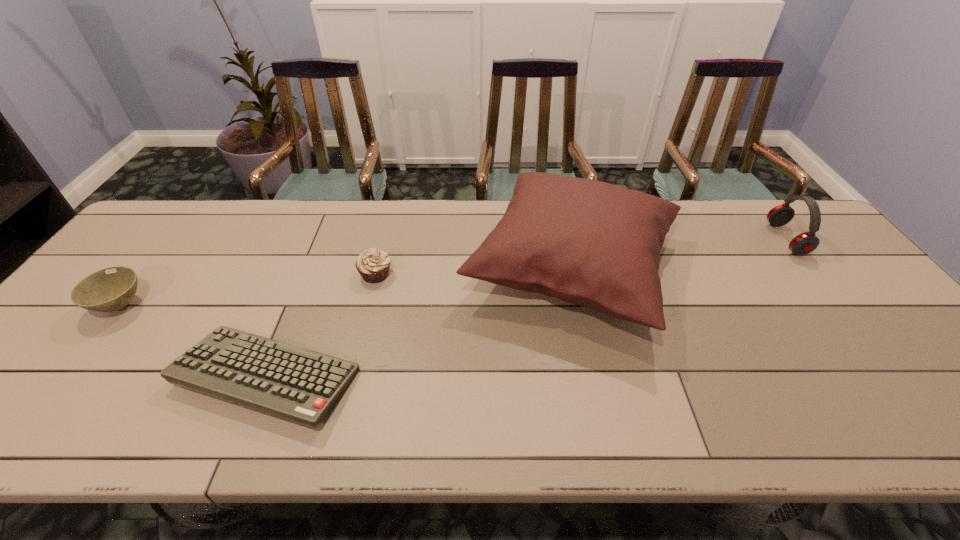
Find the location of `free space at the far edge of the desktop`. free space at the far edge of the desktop is located at coordinates (496, 218).

Where is `vacant space at the near edge of the desktop`? The image size is (960, 540). vacant space at the near edge of the desktop is located at coordinates (394, 421).

In the image, there is a desktop. Identify the location of vacant space at the left edge. Image resolution: width=960 pixels, height=540 pixels. (85, 310).

Locate an element on the screen. The image size is (960, 540). free location at the right edge of the desktop is located at coordinates (857, 312).

Locate an element on the screen. The image size is (960, 540). vacant space at the far right corner is located at coordinates (786, 225).

Identify the location of unoccupied area between the leftmost object and the muffin. The width and height of the screenshot is (960, 540). click(248, 289).

The width and height of the screenshot is (960, 540). What are the coordinates of `vacant area that lies between the bowl and the cushion` in the screenshot? It's located at (347, 286).

Locate an element on the screen. The width and height of the screenshot is (960, 540). vacant area that lies between the bowl and the muffin is located at coordinates (248, 289).

Image resolution: width=960 pixels, height=540 pixels. I want to click on vacant space that is in between the leftmost object and the shortest object, so click(194, 341).

Find the location of a particular element. unoccupied area between the leftmost object and the second tallest object is located at coordinates (453, 272).